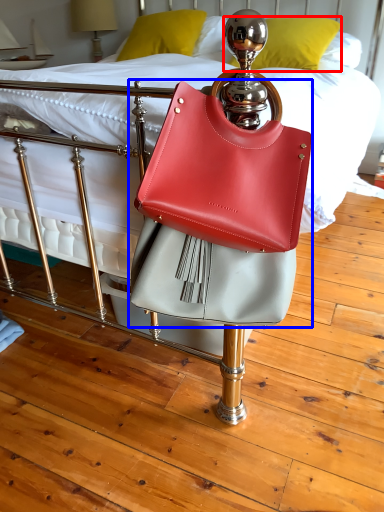
Question: Which point is further to the camera, pillow (highlighted by a red box) or handbag (highlighted by a blue box)?

Choices:
 (A) pillow
 (B) handbag

Answer: (A)